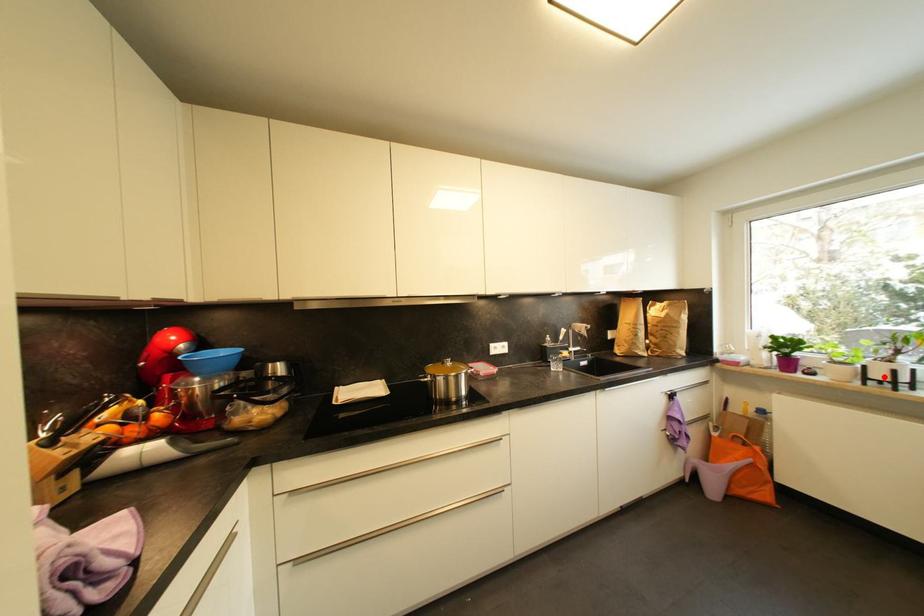
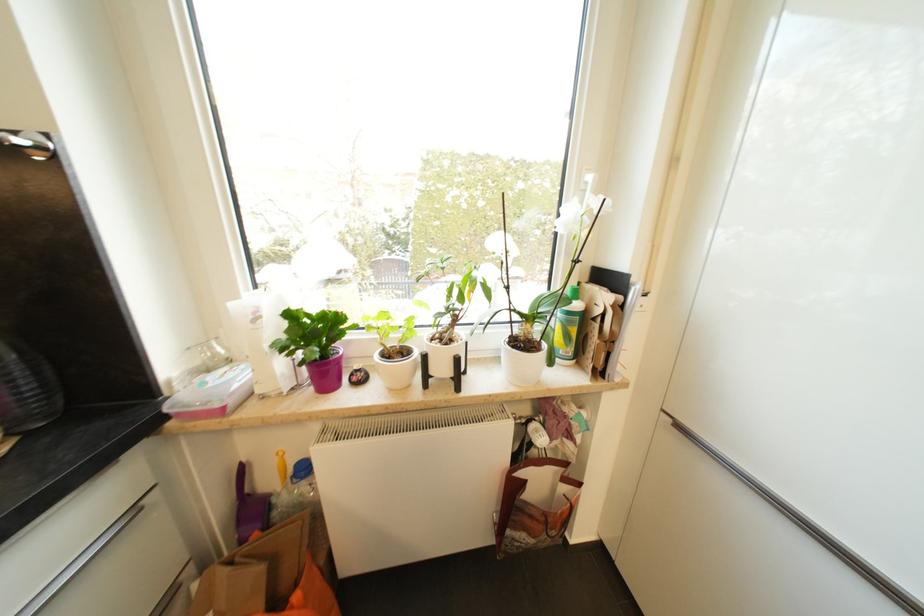
Question: I am providing you with two images of the same scene from different viewpoints. Image1 has a red point marked. In image2, the corresponding 3D location appears at what relative position? Reply with the corresponding letter.

Choices:
 (A) Closer
 (B) Farther

Answer: (B)